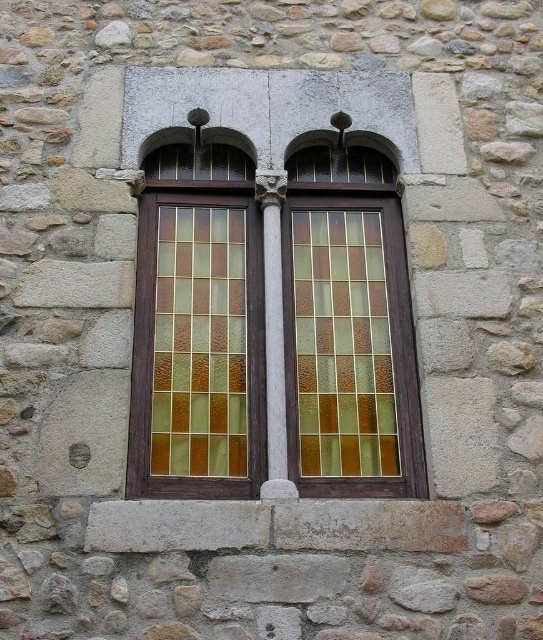
Who is more distant from viewer, (267, 413) or (153, 378)?

The point (153, 378) is behind.

Is point (334, 257) positioned before point (167, 468)?

No, it is behind (167, 468).

Identify the location of wooden stained glass window at center. This screenshot has height=640, width=543. (272, 284).

Which of these two, wooden stained glass window at center or translucent amber tiles at center, stands shorter?

With less height is translucent amber tiles at center.

What do you see at coordinates (272, 284) in the screenshot?
I see `wooden stained glass window at center` at bounding box center [272, 284].

Is point (283, 461) closer to viewer compared to point (343, 424)?

Yes, it is.

Find the location of a particular element. The image size is (543, 640). wooden stained glass window at center is located at coordinates (272, 284).

Between translucent amber tiles at center and translucent amber glass at center, which one is positioned lower?

Positioned lower is translucent amber tiles at center.

This screenshot has height=640, width=543. What do you see at coordinates (343, 344) in the screenshot?
I see `translucent amber tiles at center` at bounding box center [343, 344].

Which is in front, point (377, 420) or point (200, 310)?

Point (377, 420) is more forward.

This screenshot has height=640, width=543. I want to click on translucent amber tiles at center, so click(343, 344).